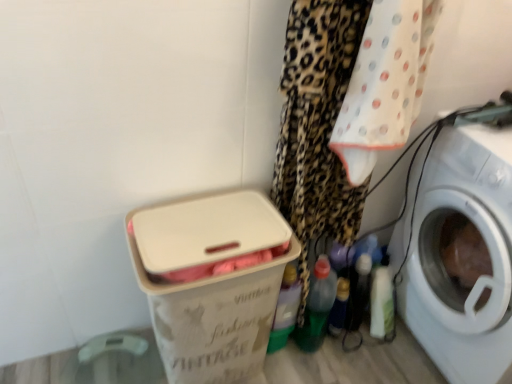
Question: Is white plastic laundry basket at lower left facing towards white plastic washing machine at right?

Choices:
 (A) yes
 (B) no

Answer: (B)

Question: Is white plastic laundry basket at lower left to the right of white plastic washing machine at right from the viewer's perspective?

Choices:
 (A) yes
 (B) no

Answer: (B)

Question: Considering the relative sizes of white plastic laundry basket at lower left and white plastic washing machine at right in the image provided, is white plastic laundry basket at lower left taller than white plastic washing machine at right?

Choices:
 (A) no
 (B) yes

Answer: (A)

Question: Is white plastic laundry basket at lower left oriented away from white plastic washing machine at right?

Choices:
 (A) yes
 (B) no

Answer: (B)

Question: Considering the relative sizes of white plastic laundry basket at lower left and white plastic washing machine at right in the image provided, is white plastic laundry basket at lower left bigger than white plastic washing machine at right?

Choices:
 (A) no
 (B) yes

Answer: (A)

Question: From the image's perspective, does white plastic laundry basket at lower left appear lower than white plastic washing machine at right?

Choices:
 (A) no
 (B) yes

Answer: (B)

Question: Would you say translucent plastic bottle at lower center contains white plastic washing machine at right?

Choices:
 (A) yes
 (B) no

Answer: (B)

Question: Is translucent plastic bottle at lower center completely or partially outside of white plastic washing machine at right?

Choices:
 (A) yes
 (B) no

Answer: (A)

Question: Considering the relative sizes of translucent plastic bottle at lower center and white plastic washing machine at right in the image provided, is translucent plastic bottle at lower center shorter than white plastic washing machine at right?

Choices:
 (A) no
 (B) yes

Answer: (B)

Question: Is translucent plastic bottle at lower center far away from white plastic washing machine at right?

Choices:
 (A) yes
 (B) no

Answer: (B)

Question: Does translucent plastic bottle at lower center have a greater height compared to white plastic washing machine at right?

Choices:
 (A) yes
 (B) no

Answer: (B)

Question: From a real-world perspective, is translucent plastic bottle at lower center beneath white plastic washing machine at right?

Choices:
 (A) yes
 (B) no

Answer: (A)

Question: Can you confirm if white plastic washing machine at right is wider than white plastic laundry basket at lower left?

Choices:
 (A) yes
 (B) no

Answer: (A)